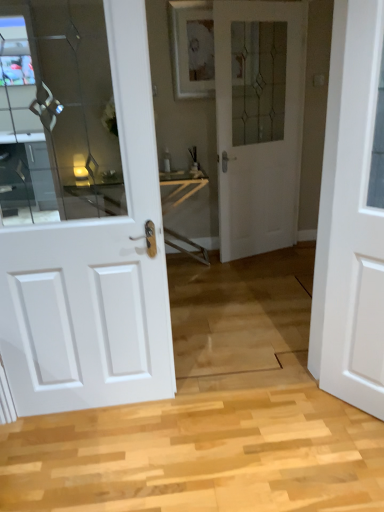
I want to click on free space in front of white glass door at center, which ranks as the 2th door in left-to-right order, so click(x=263, y=276).